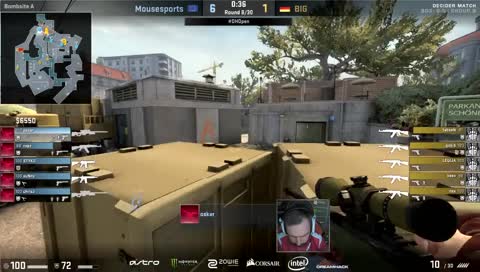
Image resolution: width=480 pixels, height=272 pixels. Identify the location of metallic vents. (124, 94), (206, 93).